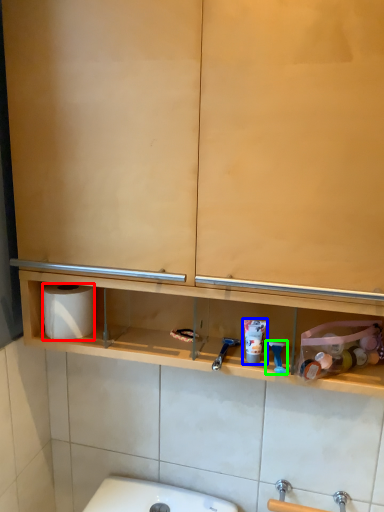
Question: Based on their relative distances, which object is farther from toilet paper (highlighted by a red box)? Choose from shaving cream (highlighted by a blue box) and shower (highlighted by a green box).

Choices:
 (A) shaving cream
 (B) shower

Answer: (B)